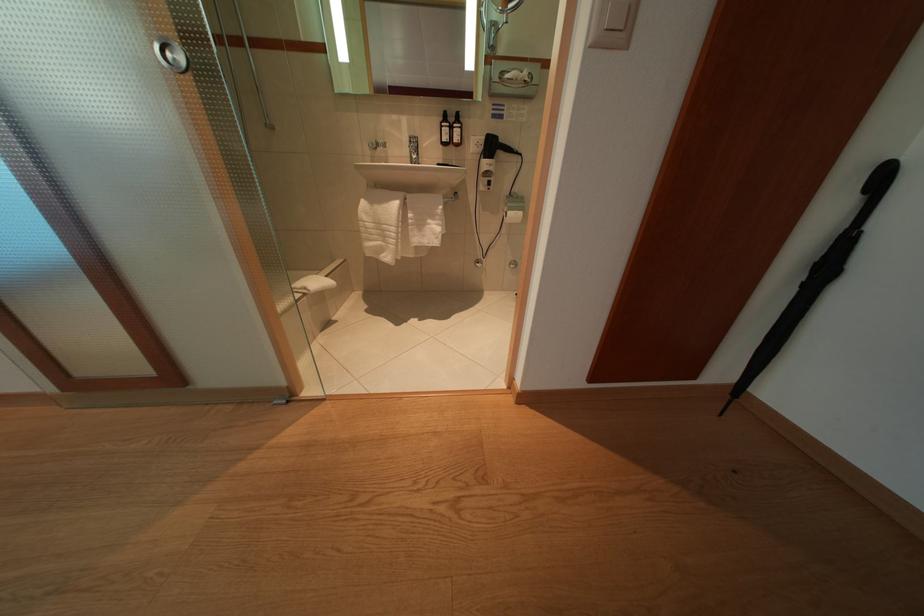
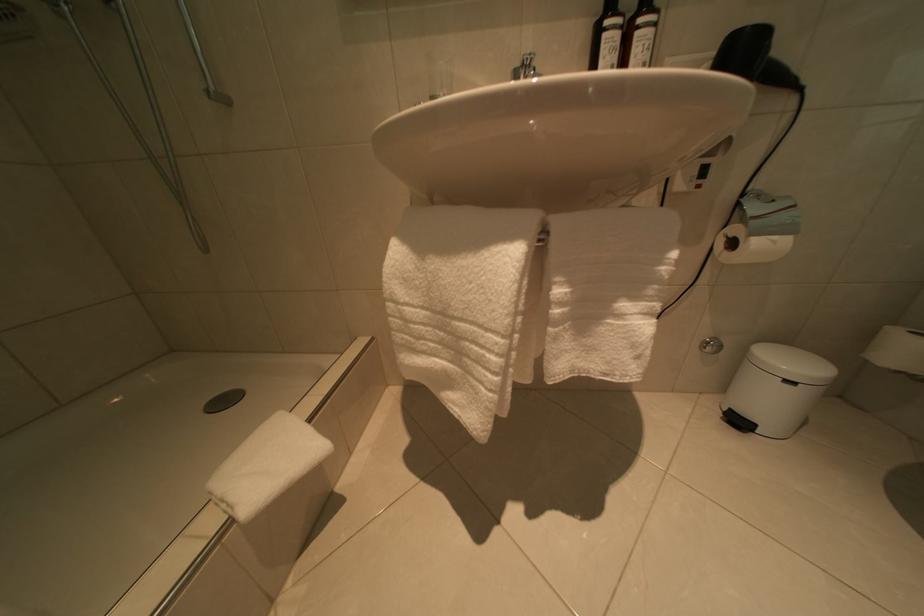
The images are taken continuously from a first-person perspective. In which direction are you moving?

The cameraman moved toward left, forward.